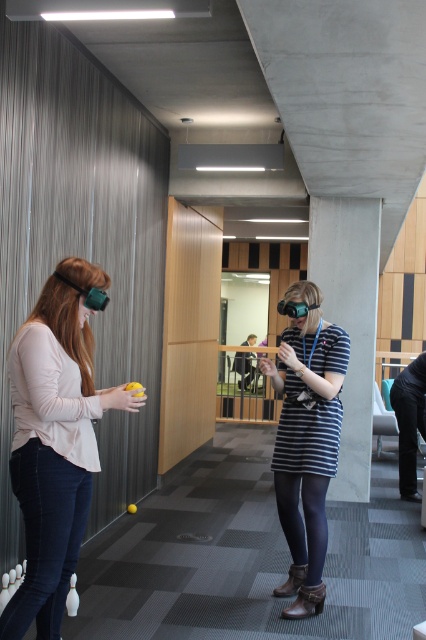
Question: Which point is farther from the camera taking this photo?

Choices:
 (A) (356, 344)
 (B) (313, 307)

Answer: (A)

Question: Which point is farther to the camera?

Choices:
 (A) (118, 396)
 (B) (101, 291)
 (C) (305, 403)
 (D) (298, 301)

Answer: (C)

Question: Does matte green goggles at left have a lesser width compared to matte black goggles at center?

Choices:
 (A) yes
 (B) no

Answer: (B)

Question: From the image, what is the correct spatial relationship of white marble pillar at center in relation to matte green goggles at left?

Choices:
 (A) above
 (B) below

Answer: (B)

Question: Which object appears farthest from the camera in this image?

Choices:
 (A) white marble pillar at center
 (B) matte green vr headset at left
 (C) striped fabric dress at center

Answer: (A)

Question: Does striped fabric dress at center have a lesser width compared to matte black goggles at center?

Choices:
 (A) yes
 (B) no

Answer: (B)